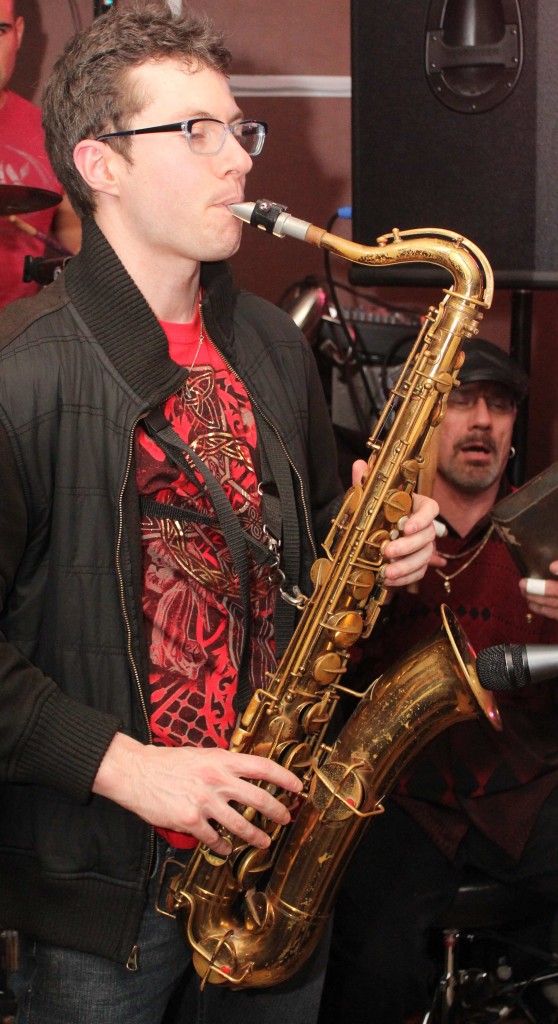
Where is `black speaker`? Image resolution: width=558 pixels, height=1024 pixels. black speaker is located at coordinates (513, 165).